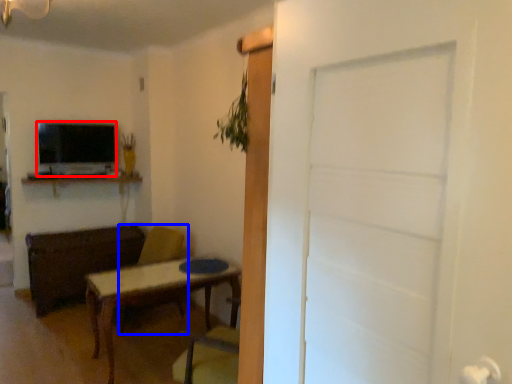
Question: Which point is further to the camera, television (highlighted by a red box) or swivel chair (highlighted by a blue box)?

Choices:
 (A) television
 (B) swivel chair

Answer: (A)